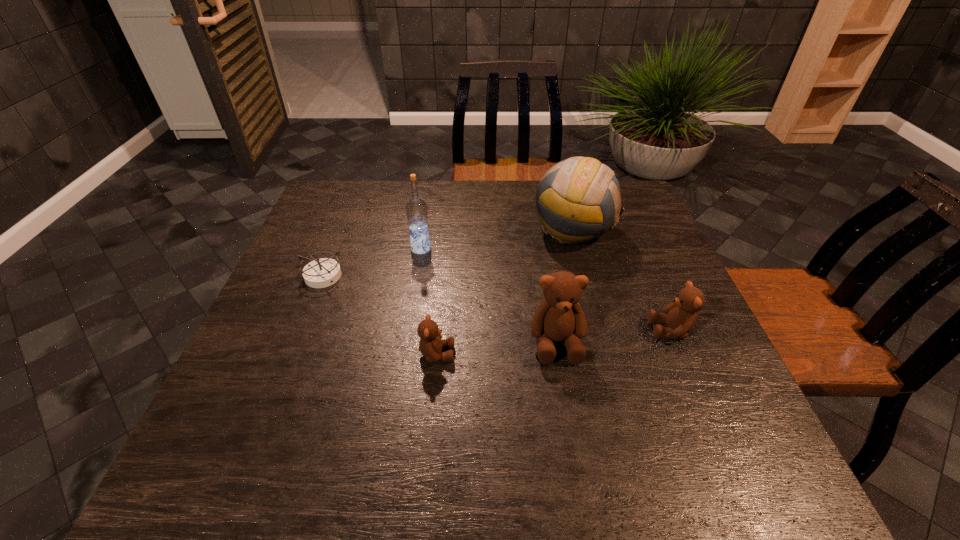
The image size is (960, 540). I want to click on teddy bear located at the right edge, so [680, 317].

You are a GUI agent. You are given a task and a screenshot of the screen. Output one action in this format:
    pyautogui.click(x=<x>, y=<y>)
    Task: Click on the volleyball that is at the right edge
    The image size is (960, 540).
    Given the screenshot: What is the action you would take?
    pyautogui.click(x=578, y=199)

The width and height of the screenshot is (960, 540). I want to click on object located in the far right corner section of the desktop, so click(578, 199).

This screenshot has height=540, width=960. In order to click on free space at the far edge in this screenshot , I will do [x=459, y=208].

In the image, there is a desktop. Where is `vacant space at the left edge`? vacant space at the left edge is located at coordinates (307, 319).

The image size is (960, 540). Find the location of `free region at the right edge of the desktop`. free region at the right edge of the desktop is located at coordinates (699, 345).

In the image, there is a desktop. Identify the location of vacant space at the far left corner. (348, 200).

The width and height of the screenshot is (960, 540). Identify the location of vacant area at the near right corner of the desktop. (667, 406).

I want to click on free space between the third object from left to right and the shortest object, so click(380, 315).

Find the location of a particular element. This screenshot has height=540, width=960. free point between the second teddy bear from right to left and the vodka is located at coordinates (489, 295).